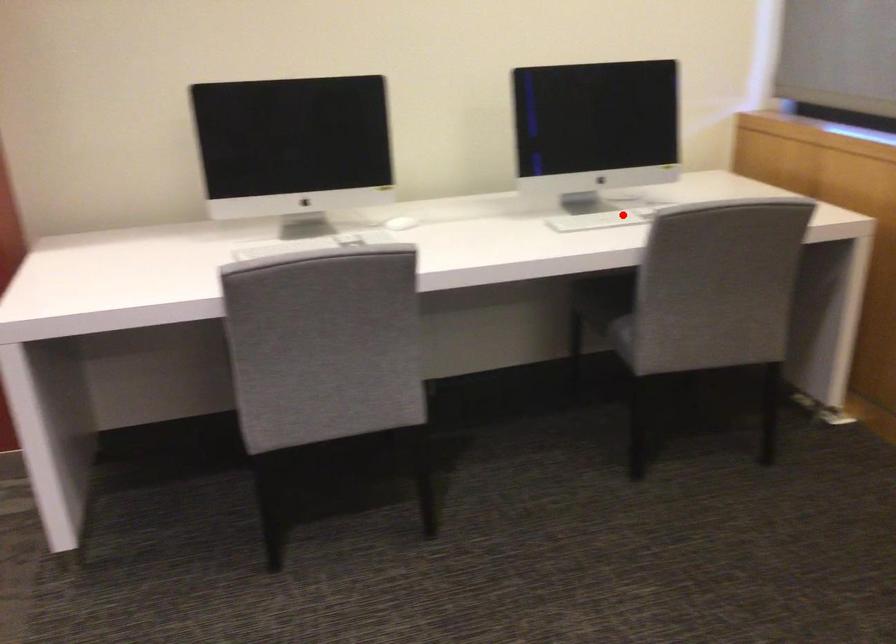
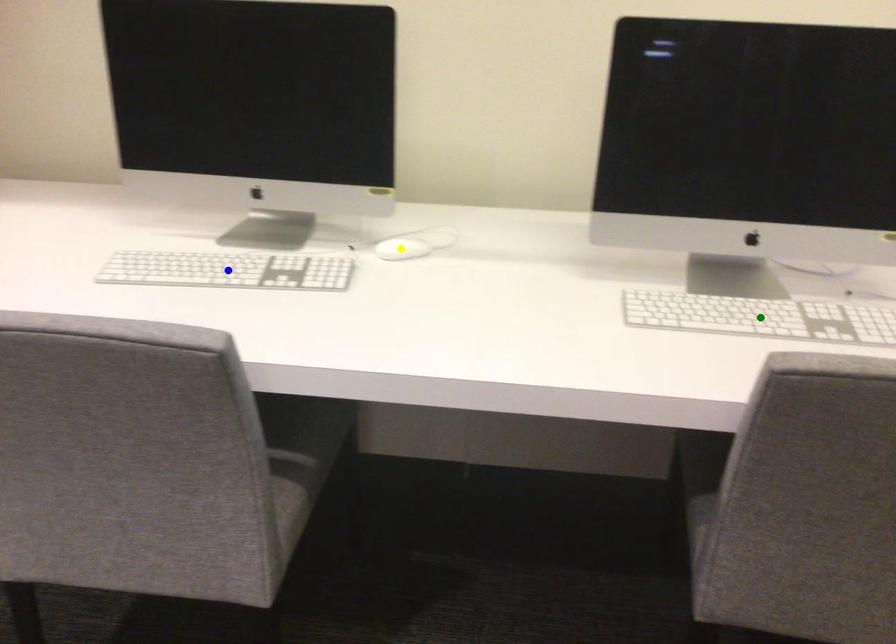
Question: I am providing you with two images of the same scene from different viewpoints. A red point is marked on the first image. You are given multiple points on the second image. Can you choose the point in image 2 that corresponds to the point in image 1?

Choices:
 (A) yellow point
 (B) blue point
 (C) green point

Answer: (C)